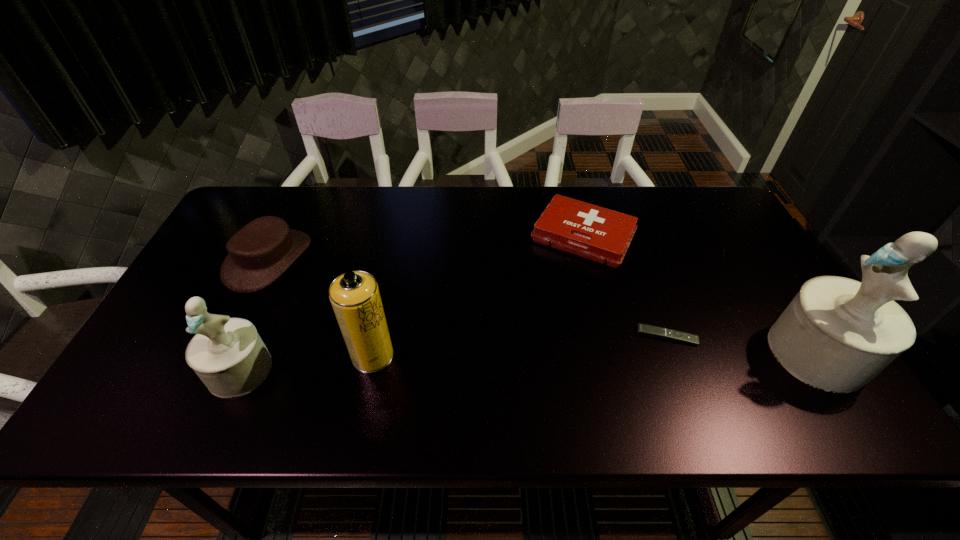
Find the location of a particular element. This screenshot has height=540, width=960. object situated at the near right corner is located at coordinates (837, 334).

What are the coordinates of `vacant space at the far edge of the desktop` in the screenshot? It's located at (362, 208).

You are a GUI agent. You are given a task and a screenshot of the screen. Output one action in this format:
    pyautogui.click(x=<x>, y=<y>)
    Task: Click on the free spot at the near edge of the desktop
    This screenshot has height=540, width=960.
    Given the screenshot: What is the action you would take?
    pyautogui.click(x=535, y=356)

Identify the location of free location at the right edge of the desktop. (707, 266).

Locate an element on the screen. vacant space at the far right corner of the desktop is located at coordinates (683, 206).

Where is `free space at the near right corner of the desktop`? This screenshot has height=540, width=960. free space at the near right corner of the desktop is located at coordinates (774, 381).

Where is `free space between the hat and the remote control`? The width and height of the screenshot is (960, 540). free space between the hat and the remote control is located at coordinates (468, 298).

Identify the location of free point between the left figurine and the shortest object. Image resolution: width=960 pixels, height=540 pixels. (453, 353).

Identify the location of vacant area that lies between the fourth object from right to left and the remote control. (519, 346).

Find the location of a particular element. unoccupied area between the left figurine and the second shortest object is located at coordinates (412, 303).